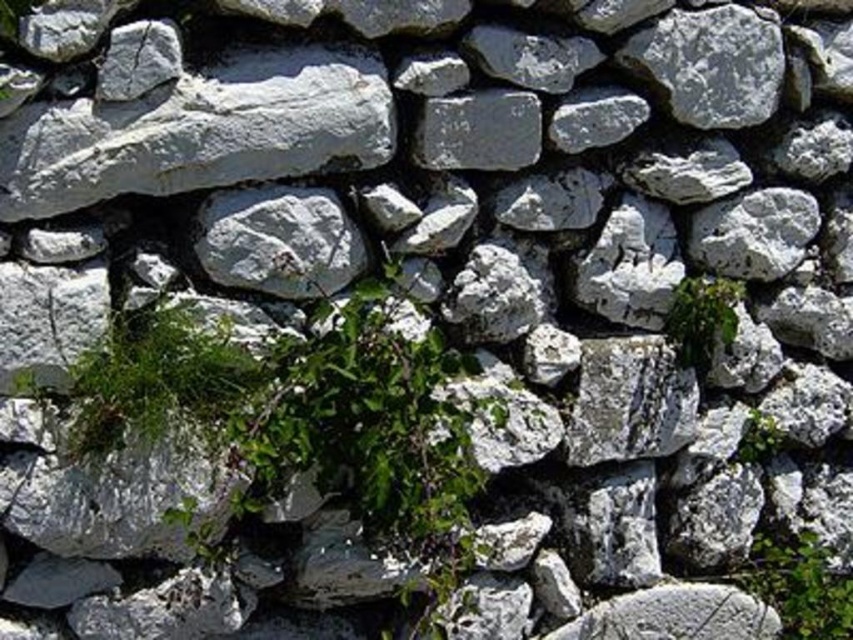
Question: Can you confirm if green leafy plant at lower right is positioned above green leafy plant at center-right?

Choices:
 (A) yes
 (B) no

Answer: (B)

Question: Which point is closer to the camera taking this photo?

Choices:
 (A) (801, 598)
 (B) (733, 321)
 (C) (753, 445)

Answer: (B)

Question: Estimate the real-world distances between objects in this image. Which object is farther from the green leafy plant at center?

Choices:
 (A) green leafy plant at lower right
 (B) green leafy plant at center-right

Answer: (A)

Question: Which of the following is the farthest from the observer?

Choices:
 (A) green leafy plant at center-right
 (B) green leafy plant at lower right

Answer: (A)

Question: Is green leafy plant at lower right thinner than green leafy plant at center-right?

Choices:
 (A) yes
 (B) no

Answer: (B)

Question: Can you confirm if green leafy plant at center is positioned above green leafy plant at center-right?

Choices:
 (A) no
 (B) yes

Answer: (B)